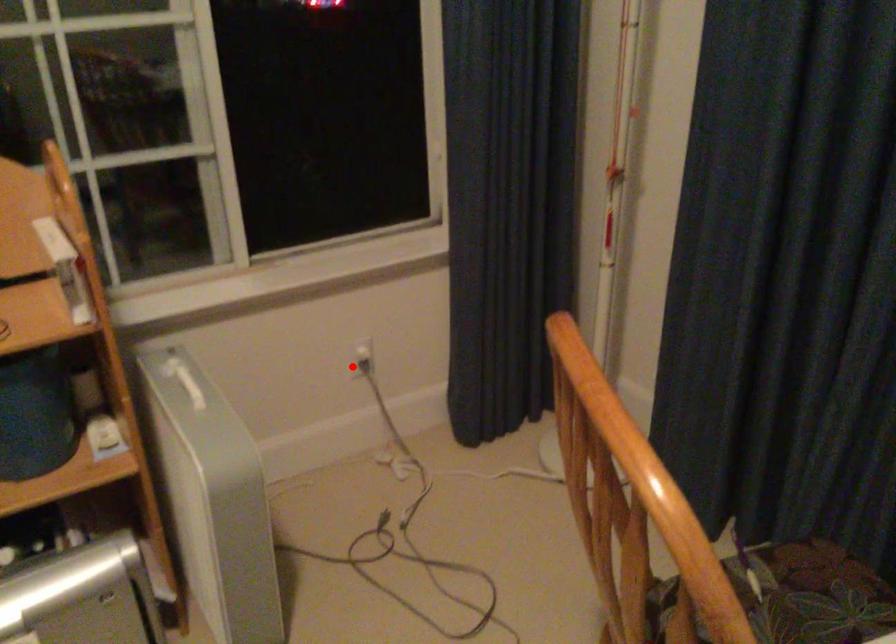
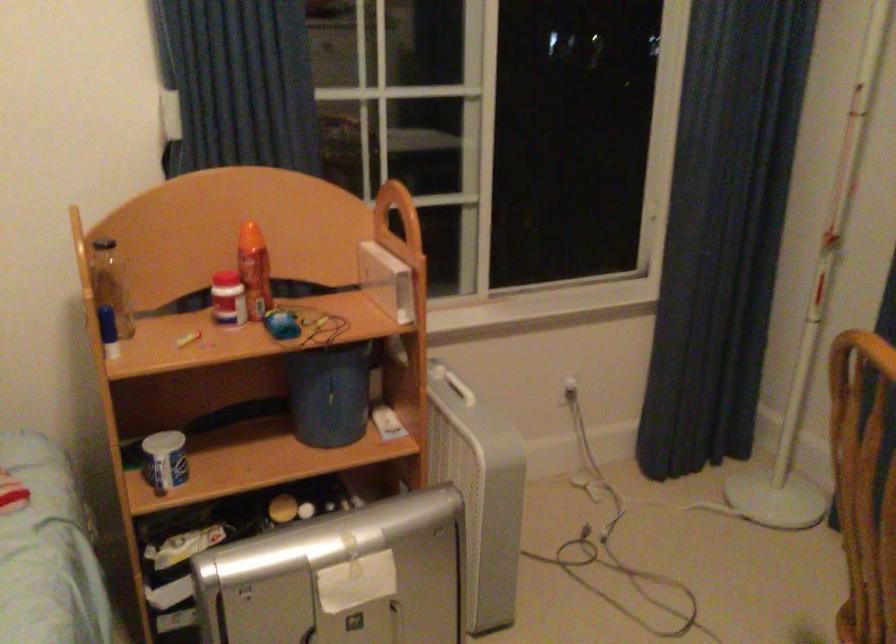
In the second image, find the point that corresponds to the highlighted location in the first image.

(564, 392)